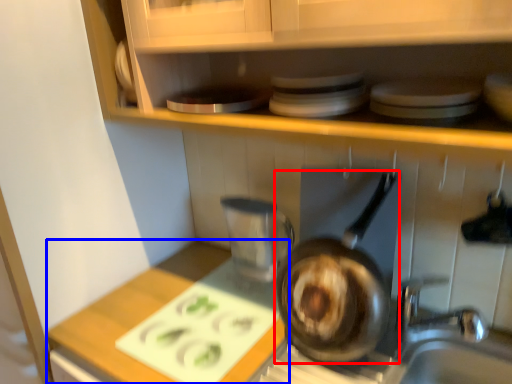
Question: Which object appears closest to the camera in this image, frying pan (highlighted by a red box) or counter top (highlighted by a blue box)?

Choices:
 (A) frying pan
 (B) counter top

Answer: (B)